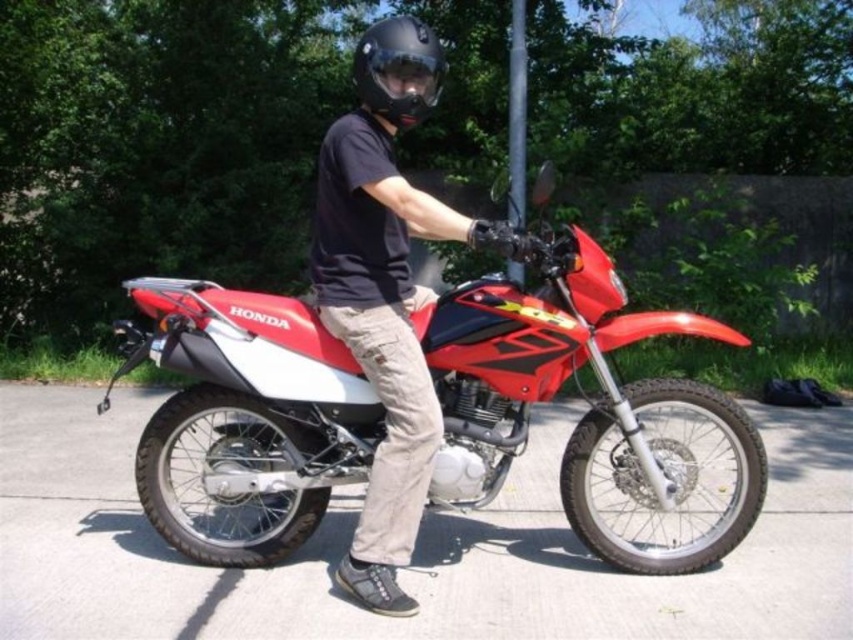
Question: From the image, what is the correct spatial relationship of matte black helmet at center in relation to matte black goggles at center?

Choices:
 (A) above
 (B) below

Answer: (B)

Question: Which point is closer to the camera taking this photo?

Choices:
 (A) (426, 92)
 (B) (322, 330)
 (C) (410, 198)

Answer: (C)

Question: Which point is closer to the camera?

Choices:
 (A) red matte/satin motorcycle at center
 (B) matte black goggles at center

Answer: (A)

Question: Can you confirm if red matte/satin motorcycle at center is positioned below black matte helmet at center?

Choices:
 (A) no
 (B) yes

Answer: (B)

Question: Among these points, which one is farthest from the camera?

Choices:
 (A) (376, 109)
 (B) (376, 579)

Answer: (A)

Question: In this image, where is red matte/satin motorcycle at center located relative to matte black helmet at center?

Choices:
 (A) left
 (B) right

Answer: (B)